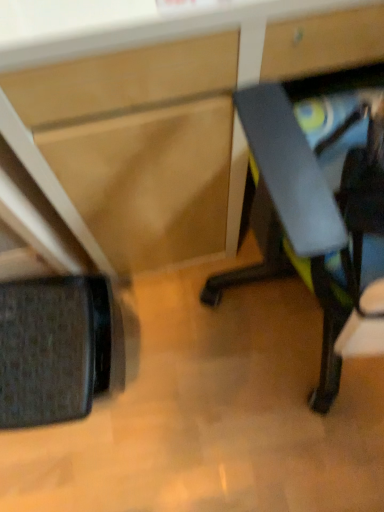
Find the location of a particular element. matte gray desk at center is located at coordinates (157, 113).

The image size is (384, 512). What do you see at coordinates (157, 113) in the screenshot?
I see `matte gray desk at center` at bounding box center [157, 113].

Locate an element on the screen. This screenshot has height=512, width=384. matte gray desk at center is located at coordinates tap(157, 113).